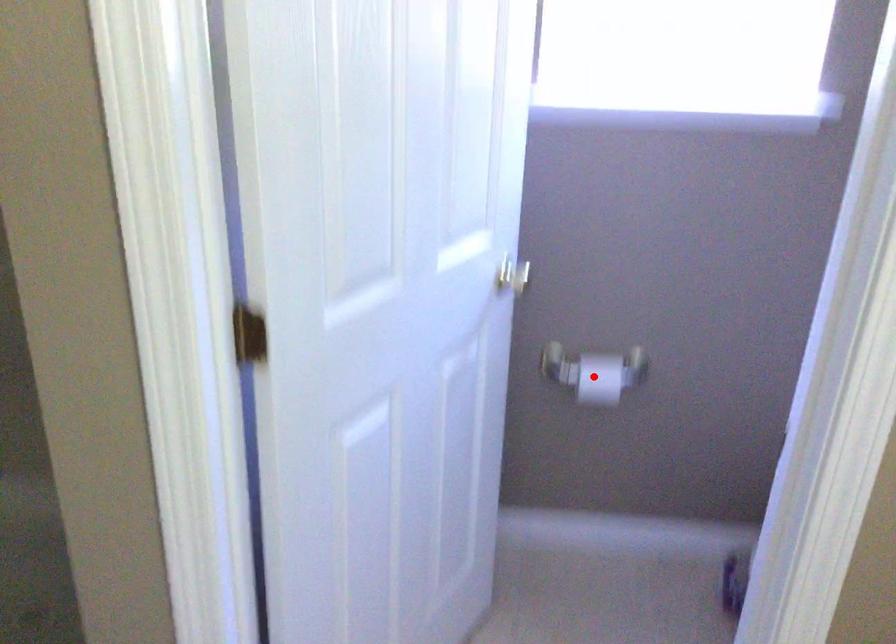
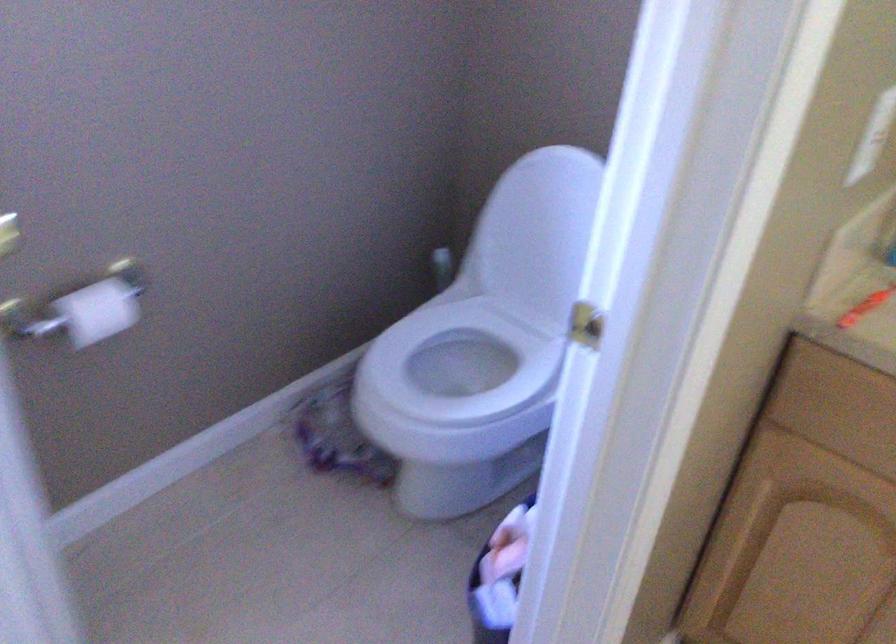
In the second image, find the point that corresponds to the highlighted location in the first image.

(97, 310)